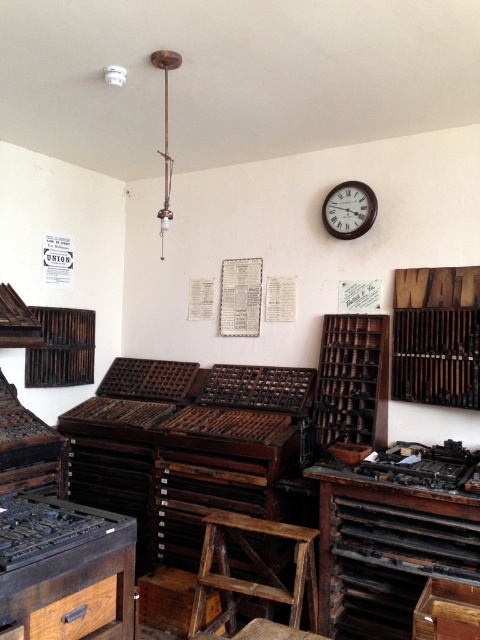
Is the dark wood workbench at lower right wider than the wooden clock at upper center?

Yes, the dark wood workbench at lower right is wider than the wooden clock at upper center according to the description.

You are an apprentice in a vintage printing workshop. You need to place a heavy ink jar on the dark brown wood workbench at lower left. However, there is a wooden clock at upper center above it. Is there enough vertical space between the workbench and the clock to safely place the jar without it hitting the clock?

The dark brown wood workbench at lower left is below the wooden clock at upper center, so there is enough vertical space between them to safely place the ink jar without it hitting the clock.